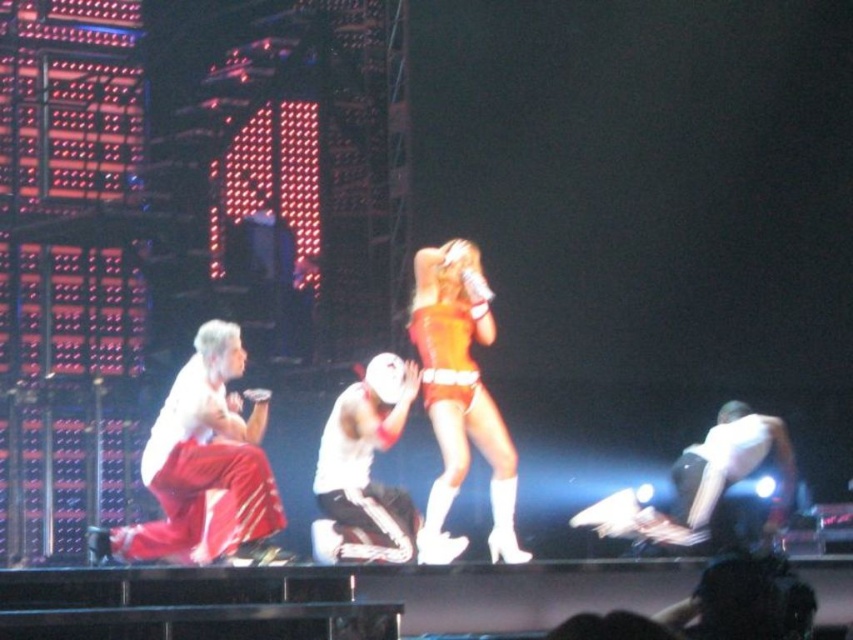
Question: Which point is farther from the camera taking this photo?

Choices:
 (A) (480, 384)
 (B) (204, 403)

Answer: (A)

Question: Is shiny red pants at left wider than white matte jersey at center?

Choices:
 (A) yes
 (B) no

Answer: (A)

Question: Is shiny red pants at left thinner than white matte jersey at center?

Choices:
 (A) yes
 (B) no

Answer: (B)

Question: Estimate the real-world distances between objects in this image. Which object is closer to the shiny orange bodysuit at center?

Choices:
 (A) shiny red pants at left
 (B) white matte jersey at center

Answer: (B)

Question: Can you confirm if shiny red pants at left is wider than shiny orange bodysuit at center?

Choices:
 (A) no
 (B) yes

Answer: (B)

Question: Among these objects, which one is nearest to the camera?

Choices:
 (A) shiny orange bodysuit at center
 (B) shiny red pants at left

Answer: (B)